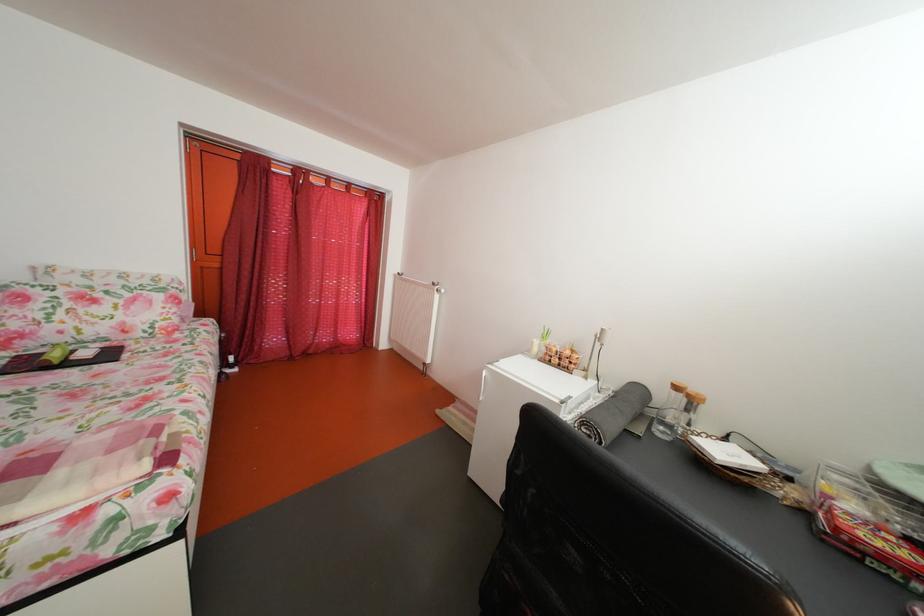
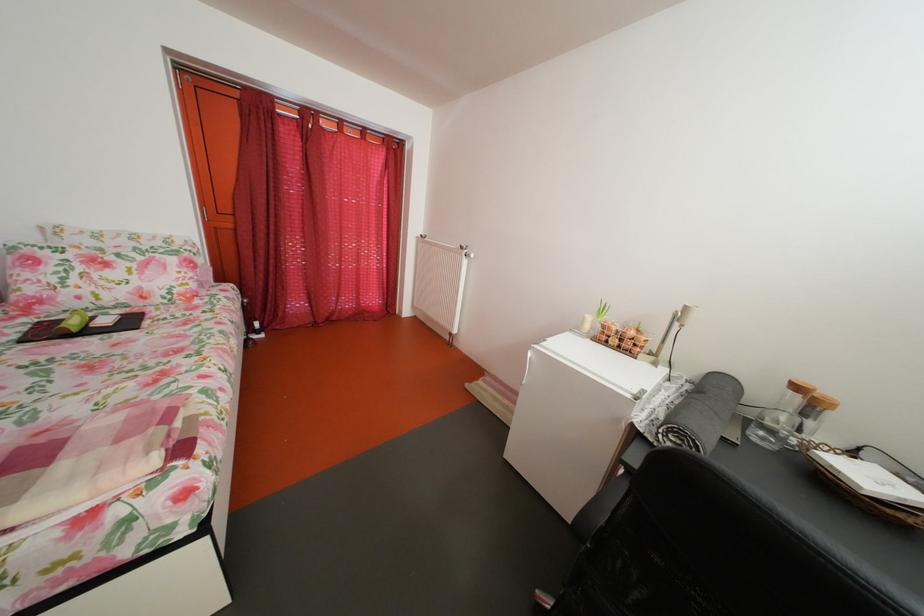
Locate, in the second image, the point that corresponds to point 481,480 in the first image.

(517, 463)